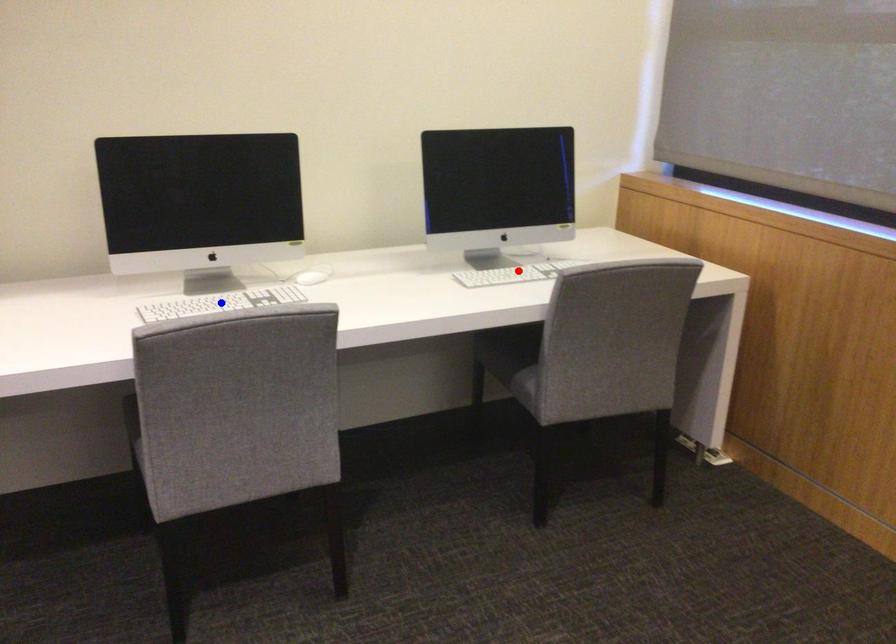
Question: In the image, two points are highlighted. Which point is nearer to the camera? Reply with the corresponding letter.

Choices:
 (A) blue point
 (B) red point

Answer: (A)